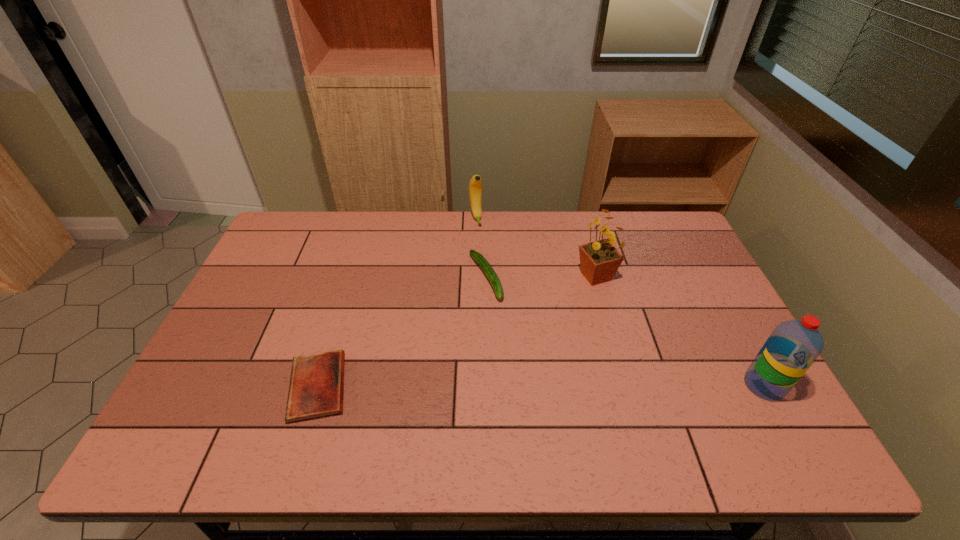
You are a GUI agent. You are given a task and a screenshot of the screen. Output one action in this format:
    pyautogui.click(x=<x>, y=<y>)
    Task: Click on the vacant point located between the shortest object and the banana
    
    Given the screenshot: What is the action you would take?
    pyautogui.click(x=396, y=302)

You are a GUI agent. You are given a task and a screenshot of the screen. Output one action in this format:
    pyautogui.click(x=<x>, y=<y>)
    Task: Click on the free space between the leftmost object and the water bottle
    This screenshot has height=540, width=960.
    Given the screenshot: What is the action you would take?
    pyautogui.click(x=541, y=386)

Locate an element on the screen. The width and height of the screenshot is (960, 540). free space between the water bottle and the shortest object is located at coordinates (541, 386).

What are the coordinates of `free space between the farthest object and the second shortest object` in the screenshot? It's located at 481,248.

Where is `blank region between the water bottle and the second object from right to left`? This screenshot has height=540, width=960. blank region between the water bottle and the second object from right to left is located at coordinates (680, 331).

Identify the location of free space between the banana and the diary. The width and height of the screenshot is (960, 540). (396, 302).

You are a GUI agent. You are given a task and a screenshot of the screen. Output one action in this format:
    pyautogui.click(x=<x>, y=<y>)
    Task: Click on the vacant area that lies between the water bottle and the banana
    
    Given the screenshot: What is the action you would take?
    pyautogui.click(x=620, y=302)

Locate an element on the screen. The image size is (960, 540). object that ranks as the third closest to the banana is located at coordinates (316, 387).

Identify the location of object that is the fourth closest one to the diary. (794, 345).

This screenshot has height=540, width=960. In order to click on vacant region that satisfies the following two spatial constraints: 1. on the front side of the second object from right to left; 2. on the right side of the banana in this screenshot , I will do `click(475, 276)`.